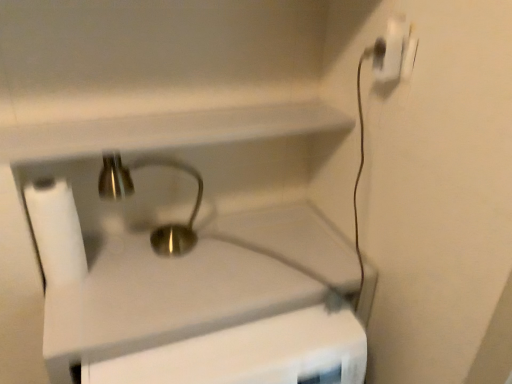
This screenshot has height=384, width=512. Identify the location of free area below polished brass faucet at center (from a real-world perspective). (141, 244).